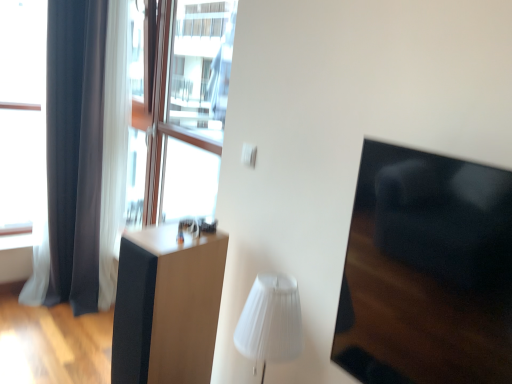
Question: From the image's perspective, is black glossy armchair at right located above or below dark gray fabric curtain at left?

Choices:
 (A) above
 (B) below

Answer: (B)

Question: Is point (499, 307) positioned closer to the camera than point (75, 210)?

Choices:
 (A) farther
 (B) closer

Answer: (B)

Question: Which of these objects is positioned farthest from the transparent glass window at upper left?

Choices:
 (A) black glossy armchair at right
 (B) dark gray fabric curtain at left
 (C) matte black speaker at center
 (D) white pleated shade at center

Answer: (A)

Question: Estimate the real-world distances between objects in this image. Which object is closer to the black glossy armchair at right?

Choices:
 (A) transparent glass window at upper left
 (B) dark gray fabric curtain at left
 (C) white pleated shade at center
 (D) matte black speaker at center

Answer: (C)